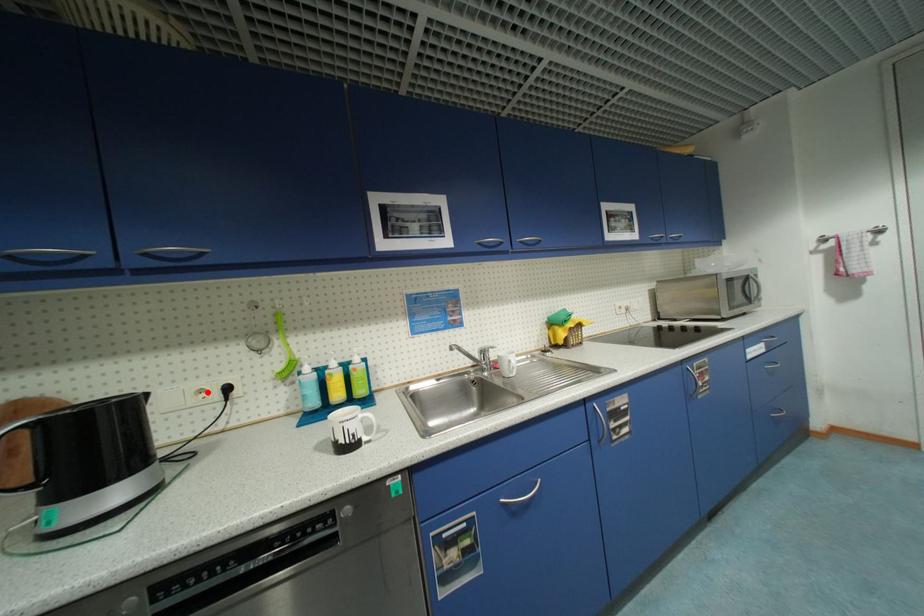
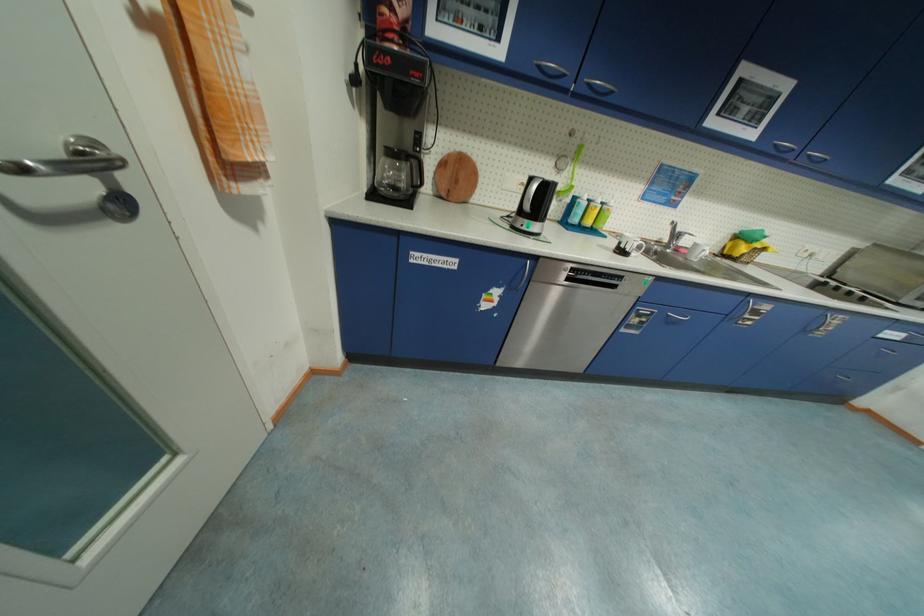
Locate, in the second image, the point that corresponds to the highlighted location in the first image.

(529, 185)